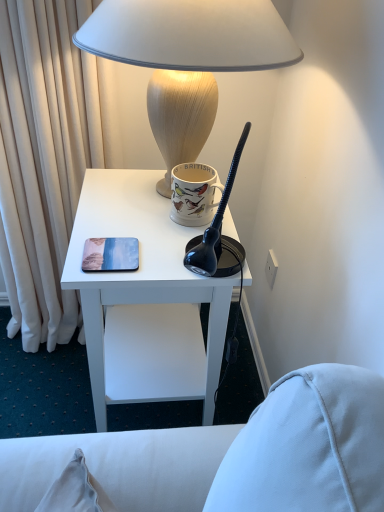
Question: Can you confirm if matte plastic coaster at center left is positioned to the right of white matte desk at center?

Choices:
 (A) yes
 (B) no

Answer: (B)

Question: From a real-world perspective, is matte plastic coaster at center left physically below white matte desk at center?

Choices:
 (A) yes
 (B) no

Answer: (B)

Question: Can we say matte plastic coaster at center left lies outside white matte desk at center?

Choices:
 (A) yes
 (B) no

Answer: (B)

Question: Could white matte desk at center be considered to be inside matte plastic coaster at center left?

Choices:
 (A) yes
 (B) no

Answer: (B)

Question: Is matte plastic coaster at center left positioned with its back to white matte desk at center?

Choices:
 (A) yes
 (B) no

Answer: (B)

Question: Is white matte desk at center situated inside matte plastic coaster at center left or outside?

Choices:
 (A) outside
 (B) inside

Answer: (A)

Question: From a real-world perspective, is white matte desk at center above or below matte plastic coaster at center left?

Choices:
 (A) above
 (B) below

Answer: (B)

Question: Is white matte desk at center in front of or behind matte plastic coaster at center left in the image?

Choices:
 (A) behind
 (B) front

Answer: (B)

Question: From the image's perspective, is white matte desk at center positioned above or below matte plastic coaster at center left?

Choices:
 (A) below
 (B) above

Answer: (A)

Question: Considering the positions of matte ceramic mug at upper center and white matte desk at center in the image, is matte ceramic mug at upper center wider or thinner than white matte desk at center?

Choices:
 (A) thin
 (B) wide

Answer: (A)

Question: Is matte ceramic mug at upper center inside or outside of white matte desk at center?

Choices:
 (A) outside
 (B) inside

Answer: (A)

Question: Does point coord(177,209) appear closer or farther from the camera than point coord(139,182)?

Choices:
 (A) closer
 (B) farther

Answer: (A)

Question: From a real-world perspective, is matte ceramic mug at upper center positioned above or below white matte desk at center?

Choices:
 (A) below
 (B) above

Answer: (B)

Question: From their relative heights in the image, would you say matte plastic coaster at center left is taller or shorter than matte beige lamp at upper center?

Choices:
 (A) tall
 (B) short

Answer: (B)

Question: Considering the positions of matte plastic coaster at center left and matte beige lamp at upper center in the image, is matte plastic coaster at center left wider or thinner than matte beige lamp at upper center?

Choices:
 (A) wide
 (B) thin

Answer: (B)